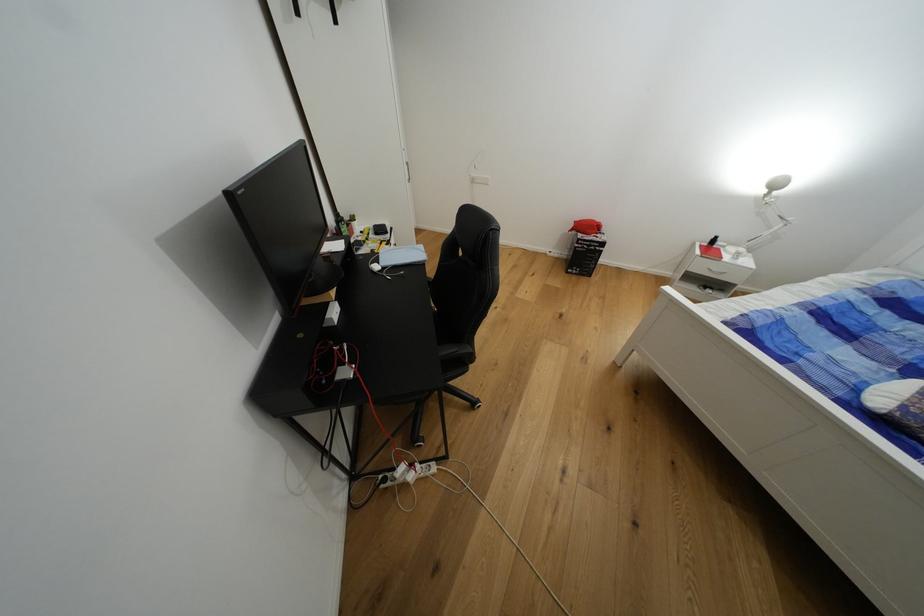
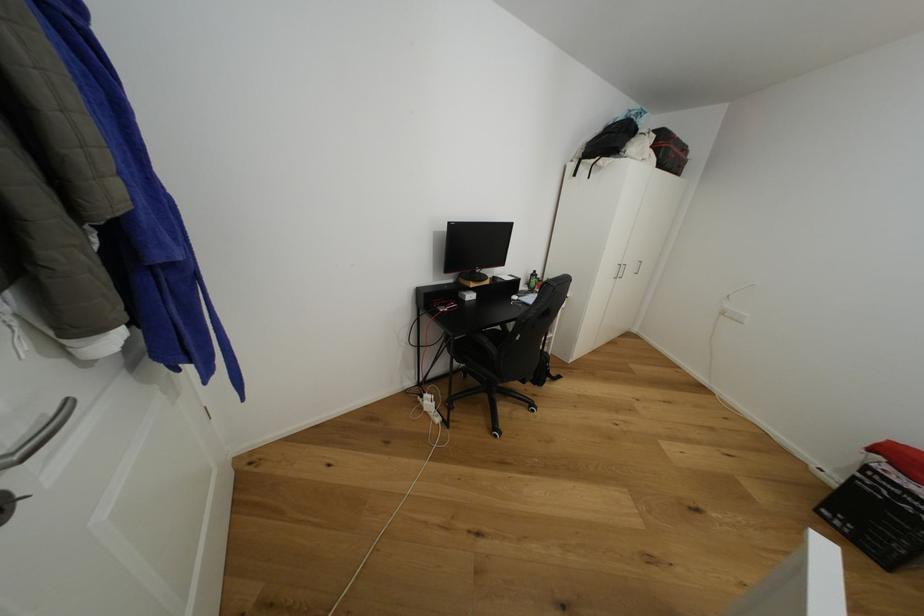
Where in the second image is the point corresponding to (586,237) from the first image?

(893, 469)